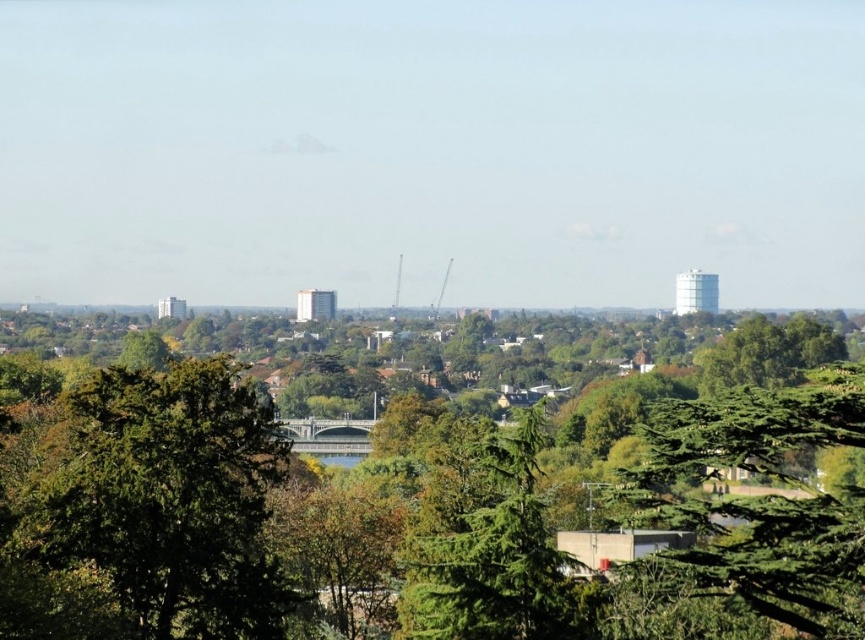
Question: Is green leafy tree at center positioned at the back of green textured tree at lower right?

Choices:
 (A) no
 (B) yes

Answer: (A)

Question: Based on their relative distances, which object is farther from the green textured tree at lower right?

Choices:
 (A) green leafy tree at center
 (B) green leafy tree at lower left

Answer: (B)

Question: Does green leafy tree at lower left come behind green textured tree at lower right?

Choices:
 (A) no
 (B) yes

Answer: (B)

Question: Can you confirm if green leafy tree at center is positioned to the right of green textured tree at lower right?

Choices:
 (A) yes
 (B) no

Answer: (B)

Question: Which is farther from the green textured tree at lower right?

Choices:
 (A) green leafy tree at lower left
 (B) green textured tree at center

Answer: (A)

Question: Which point is closer to the camera?

Choices:
 (A) green textured tree at center
 (B) green textured tree at lower right
 (C) green leafy tree at lower left

Answer: (A)